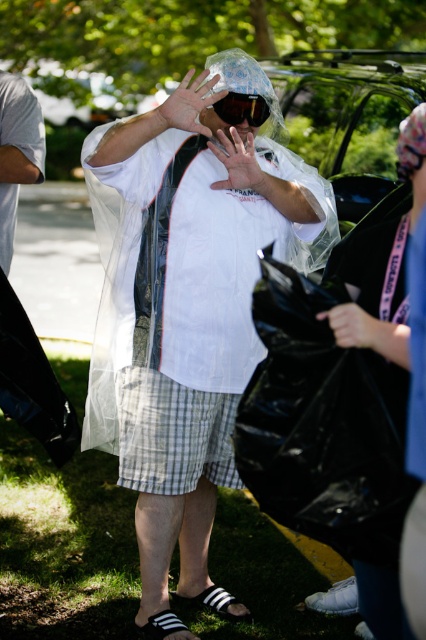
Can you confirm if transparent plastic poncho at center is wider than black matte goggles at center?

Correct, the width of transparent plastic poncho at center exceeds that of black matte goggles at center.

Does transparent plastic poncho at center come behind black matte goggles at center?

No.

Does point (172, 138) come farther from viewer compared to point (252, 108)?

Yes, point (172, 138) is behind point (252, 108).

Find the location of a particular element. The width and height of the screenshot is (426, 640). transparent plastic poncho at center is located at coordinates (184, 330).

Between point (28, 86) and point (198, 109), which one is positioned behind?

The point (28, 86) is more distant.

Between point (11, 81) and point (138, 120), which one is positioned in front?

Point (138, 120) is in front.

Does point (3, 113) lie behind point (160, 109)?

Yes, point (3, 113) is behind point (160, 109).

I want to click on white matte t-shirt at center, so click(17, 154).

This screenshot has width=426, height=640. Describe the element at coordinates (238, 161) in the screenshot. I see `matte white hand at center` at that location.

Where is `matte white hand at center`? This screenshot has height=640, width=426. matte white hand at center is located at coordinates (238, 161).